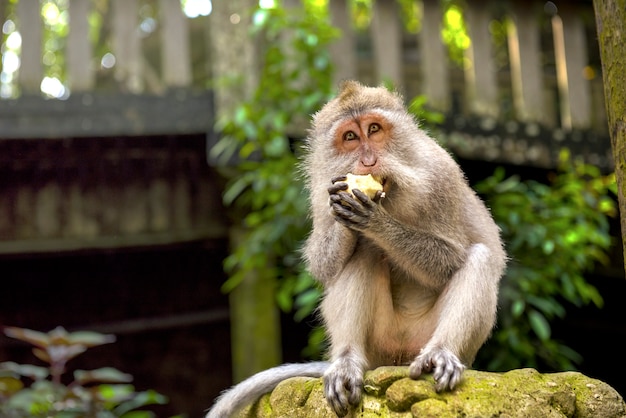
Find the location of a particular element. Image resolution: width=626 pixels, height=418 pixels. flowering plant is located at coordinates 56,365.